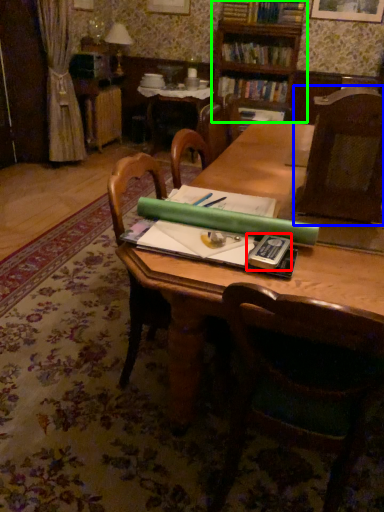
Question: Which object is positioned closest to paperback book (highlighted by a red box)? Select from chair (highlighted by a blue box) and bookcase (highlighted by a green box).

Choices:
 (A) chair
 (B) bookcase

Answer: (A)